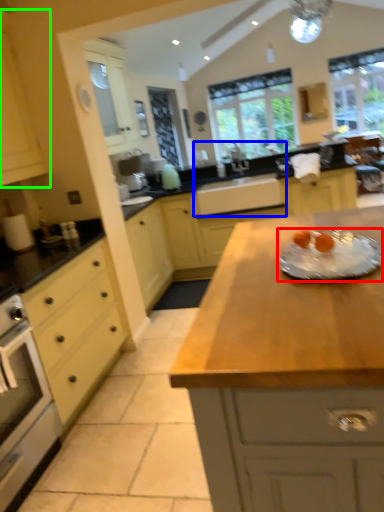
Question: Based on their relative distances, which object is farther from glass plate (highlighted by a red box)? Choose from sink (highlighted by a blue box) and cabinetry (highlighted by a green box).

Choices:
 (A) sink
 (B) cabinetry

Answer: (A)